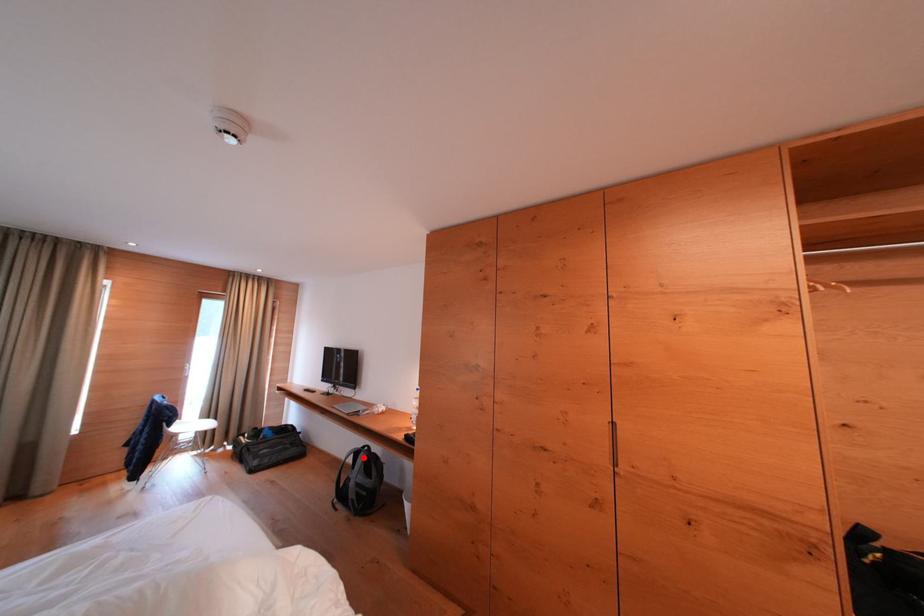
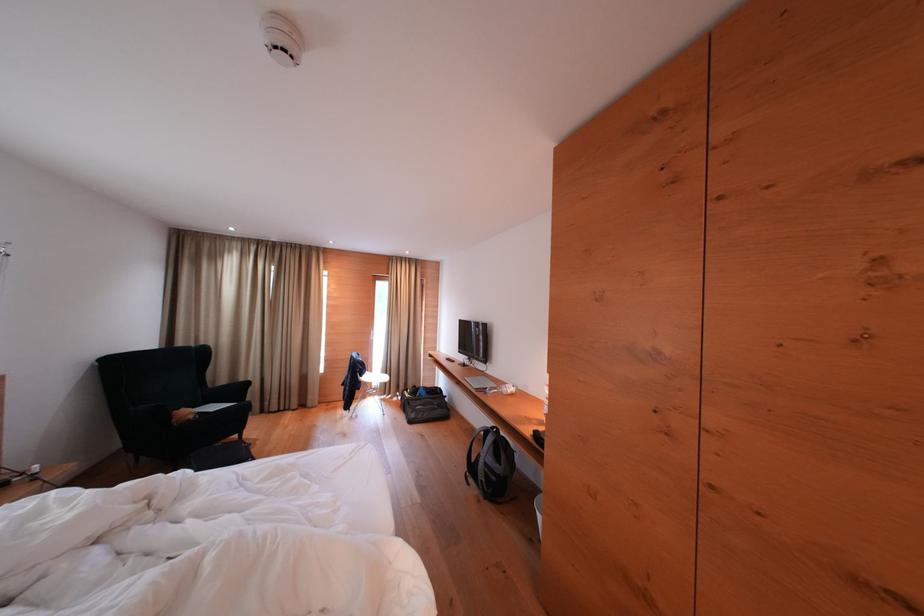
Where in the second image is the point corresponding to the highlighted location from the first image?

(493, 437)